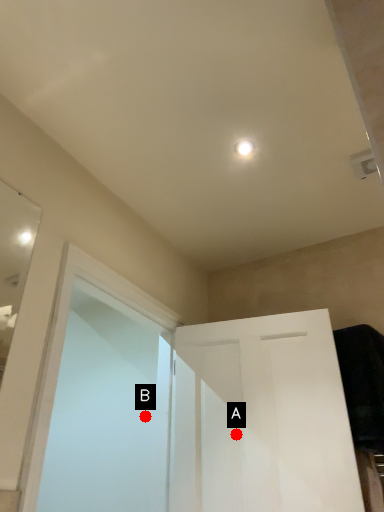
Question: Two points are circled on the image, labeled by A and B beside each circle. Which point appears farthest from the camera in this image?

Choices:
 (A) A is further
 (B) B is further

Answer: (B)